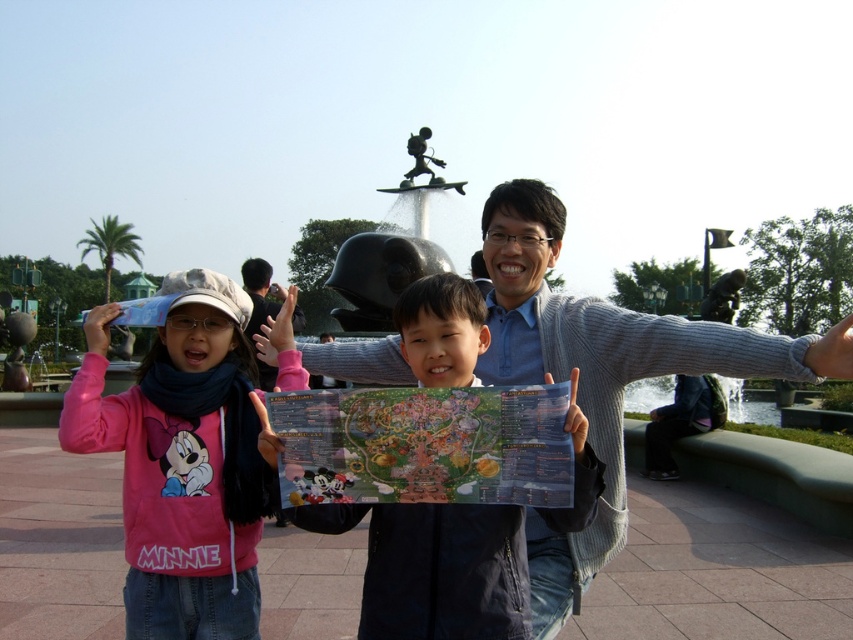
Question: Which object appears farthest from the camera in this image?

Choices:
 (A) colorful glossy map at center
 (B) multicolored paper map at center
 (C) gray knitted sweater at center
 (D) black glossy water at center

Answer: (D)

Question: Does colorful glossy map at center lie in front of black glossy water at center?

Choices:
 (A) no
 (B) yes

Answer: (B)

Question: Can you confirm if colorful glossy map at center is thinner than black glossy water at center?

Choices:
 (A) no
 (B) yes

Answer: (B)

Question: Which point is closer to the camera?

Choices:
 (A) (131, 509)
 (B) (357, 364)

Answer: (A)

Question: Which object is closer to the camera taking this photo?

Choices:
 (A) multicolored paper map at center
 (B) pink fleece sweatshirt at left

Answer: (A)

Question: Does multicolored paper map at center appear on the left side of colorful glossy map at center?

Choices:
 (A) no
 (B) yes

Answer: (A)